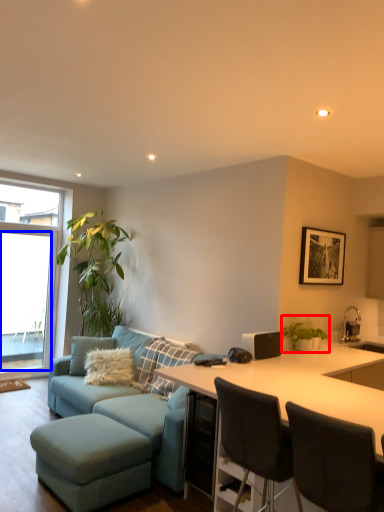
Question: Which point is further to the camera, houseplant (highlighted by a red box) or window screen (highlighted by a blue box)?

Choices:
 (A) houseplant
 (B) window screen

Answer: (B)